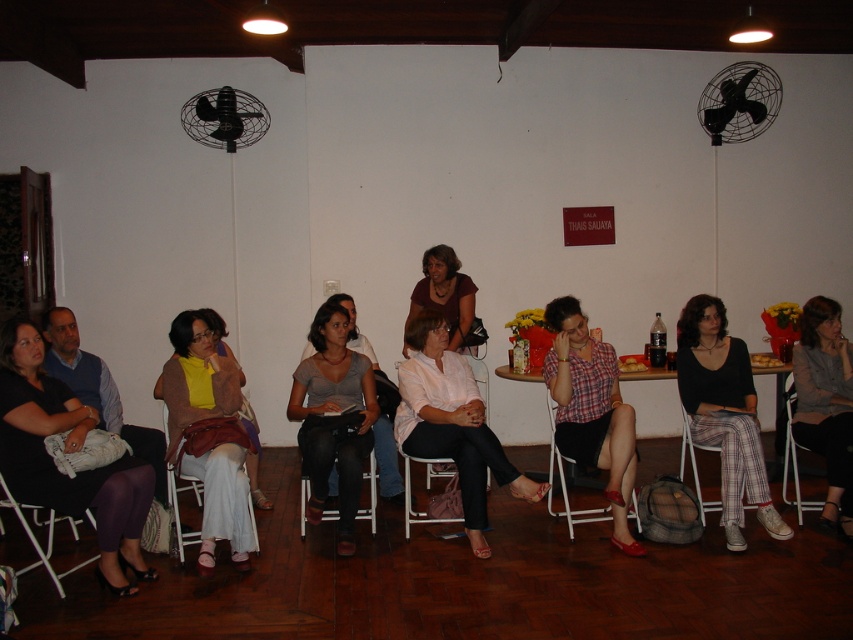
Who is lower down, white plastic chair at center or plastic at center?

plastic at center

Does point (567, 515) come in front of point (700, 502)?

That is False.

Which is behind, point (572, 536) or point (686, 435)?

Positioned behind is point (686, 435).

This screenshot has height=640, width=853. I want to click on white plastic chair at center, so click(564, 483).

Is matte gray shirt at center behind matte white chairs at center?

Yes.

From the picture: Between matte gray shirt at center and matte white chairs at center, which one appears on the right side from the viewer's perspective?

matte gray shirt at center is more to the right.

Identify the location of matte gray shirt at center. (334, 417).

Is black fabric chair at center below plastic at center?

Yes, black fabric chair at center is below plastic at center.

Is point (306, 483) in front of point (682, 406)?

No, it is behind (682, 406).

At what (x,y) coordinates should I click in order to perform the action: click on black fabric chair at center. Please return your answer as a coordinate pair (x, y). This screenshot has width=853, height=640. Looking at the image, I should click on (369, 493).